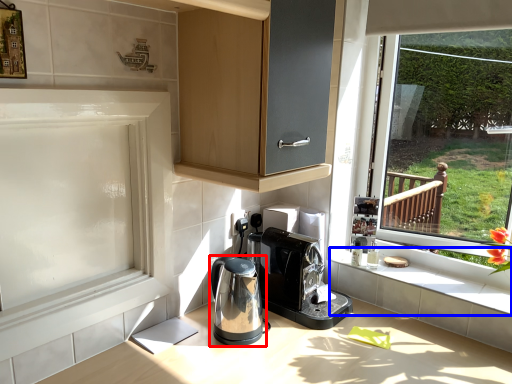
Question: Which object appears closest to the camera in this image, home appliance (highlighted by a red box) or window sill (highlighted by a blue box)?

Choices:
 (A) home appliance
 (B) window sill

Answer: (A)